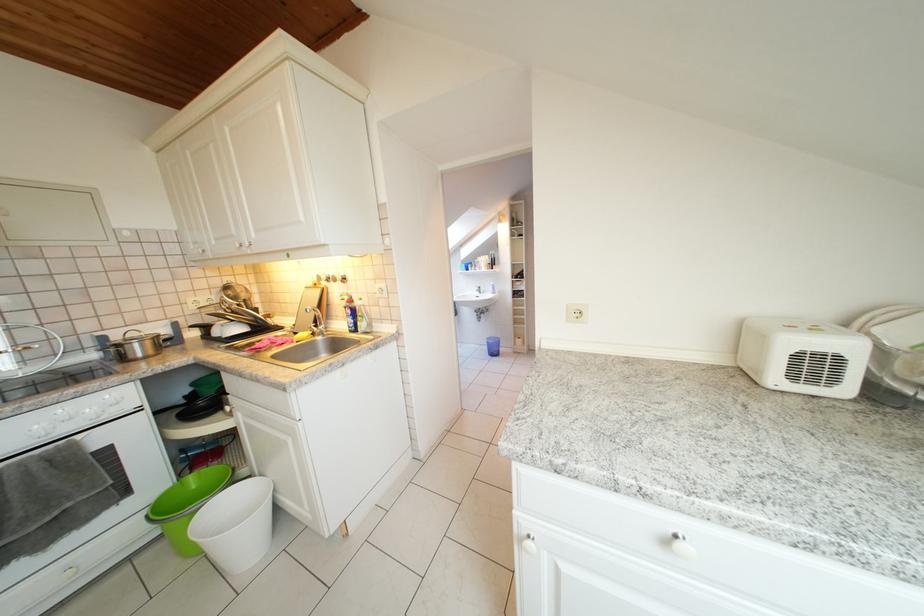
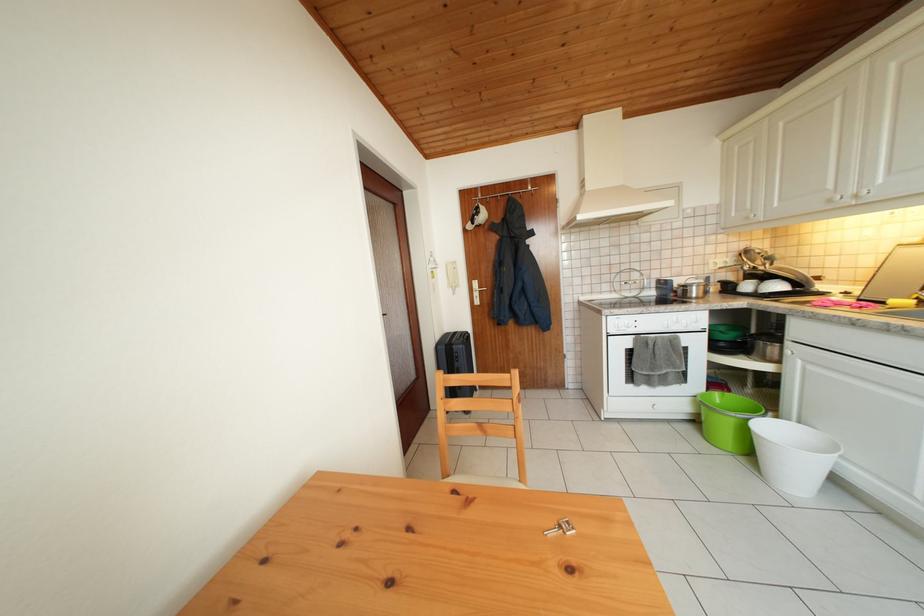
In the second image, find the point that corresponds to (x=146, y=351) in the first image.

(702, 294)